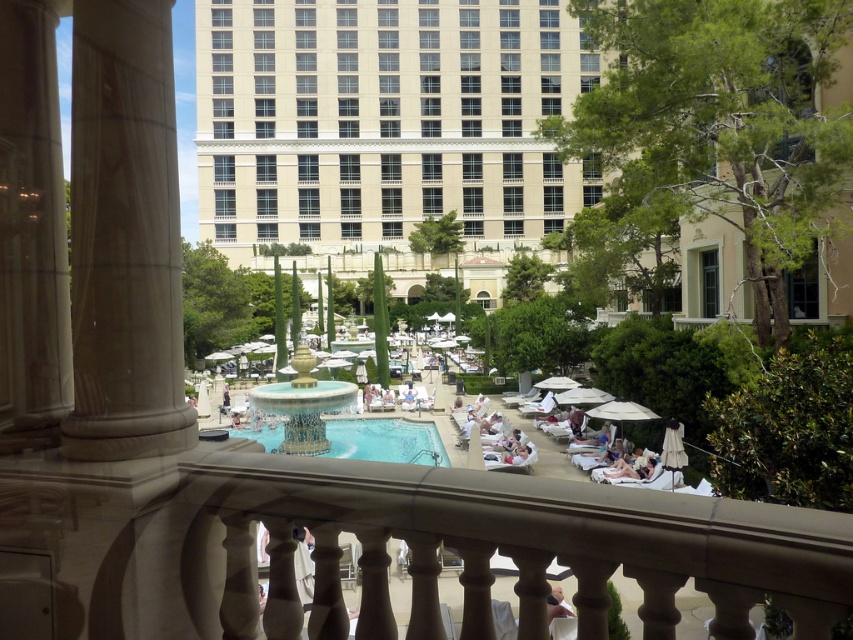
You are standing on the balcony looking down at the pool area. You see the gold metallic fountain at center and the smooth beige towel at lower center. Which object is closer to you?

The gold metallic fountain at center is closer to you because it is further to the viewer than the smooth beige towel at lower center.